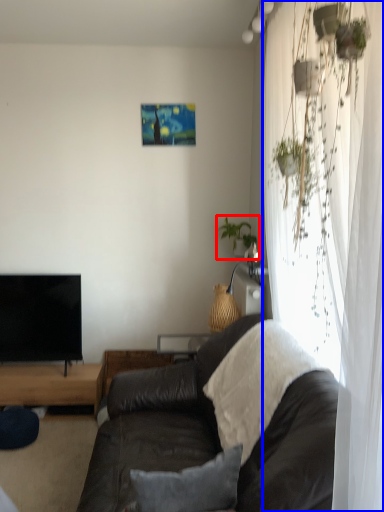
Question: Among these objects, which one is nearest to the camera, houseplant (highlighted by a red box) or curtain (highlighted by a blue box)?

Choices:
 (A) houseplant
 (B) curtain

Answer: (B)